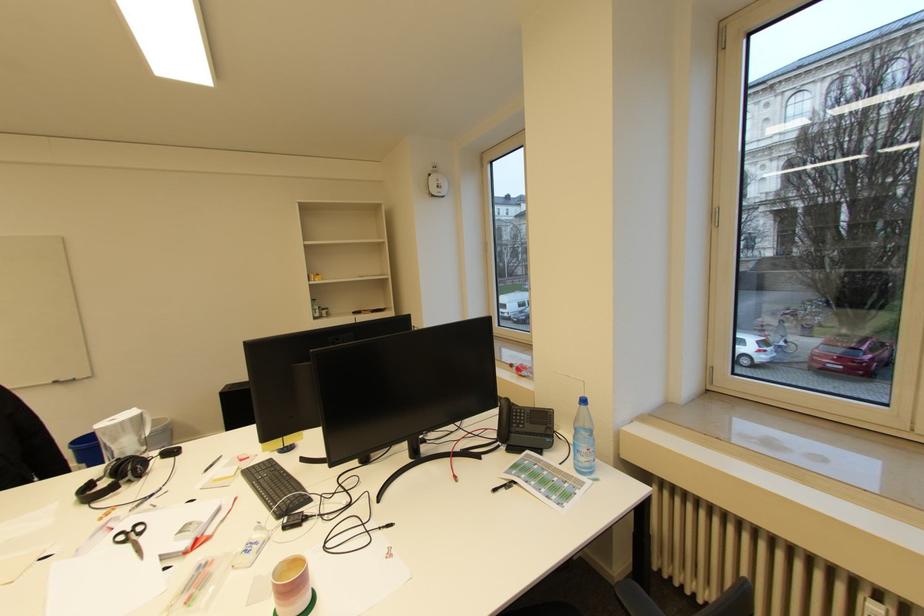
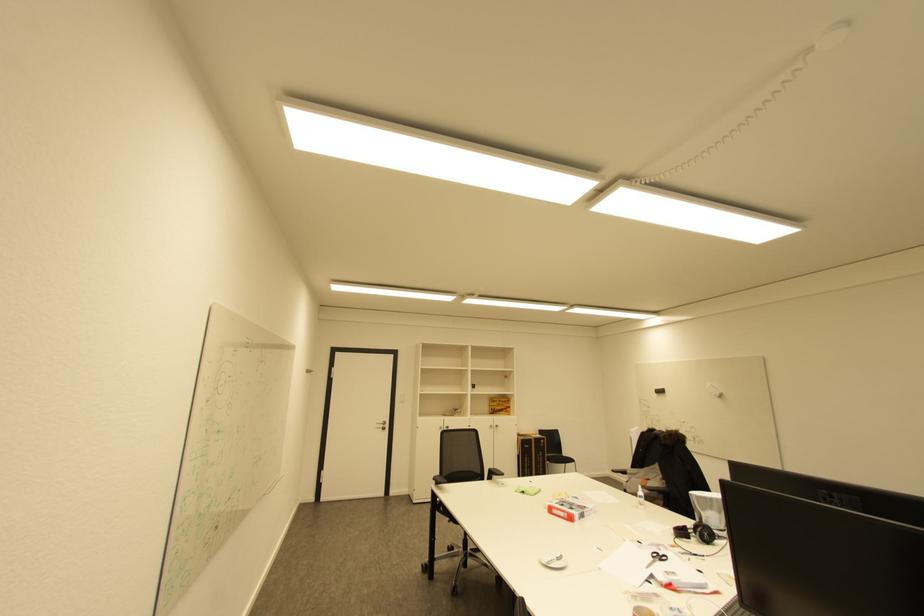
The point at (130, 543) is marked in the first image. Where is the corresponding point in the second image?

(659, 557)